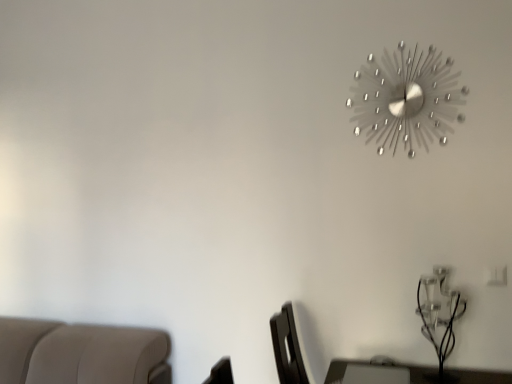
Question: In the image, is clear glass table lamp at lower right positioned in front of or behind metallic silver clock at upper right?

Choices:
 (A) front
 (B) behind

Answer: (A)

Question: In terms of width, does clear glass table lamp at lower right look wider or thinner when compared to metallic silver clock at upper right?

Choices:
 (A) thin
 (B) wide

Answer: (B)

Question: In terms of size, does clear glass table lamp at lower right appear bigger or smaller than metallic silver clock at upper right?

Choices:
 (A) small
 (B) big

Answer: (B)

Question: Do you think metallic silver clock at upper right is within clear glass table lamp at lower right, or outside of it?

Choices:
 (A) outside
 (B) inside

Answer: (A)

Question: Is metallic silver clock at upper right wider or thinner than clear glass table lamp at lower right?

Choices:
 (A) wide
 (B) thin

Answer: (B)

Question: Is point (386, 130) positioned closer to the camera than point (422, 309)?

Choices:
 (A) farther
 (B) closer

Answer: (A)

Question: From the image's perspective, is metallic silver clock at upper right above or below clear glass table lamp at lower right?

Choices:
 (A) below
 (B) above

Answer: (B)